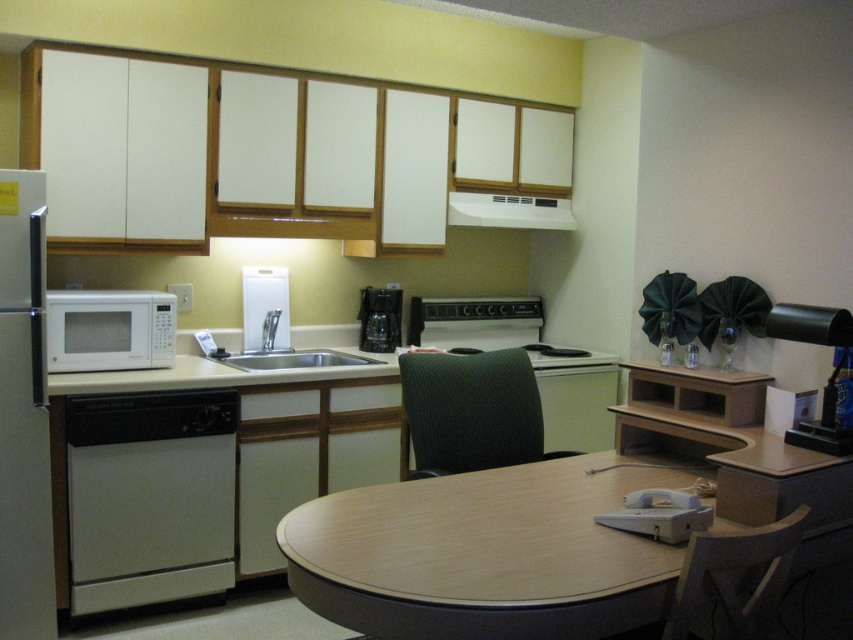
Question: Which of the following is the closest to the observer?

Choices:
 (A) white matte exhaust hood at upper center
 (B) dark gray fabric swivel chair at lower right

Answer: (B)

Question: Which is farther from the dark gray fabric swivel chair at lower right?

Choices:
 (A) white matte exhaust hood at upper center
 (B) white plastic faucet at center
 (C) white matte refrigerator at left

Answer: (B)

Question: Does wooden table at center appear under white matte microwave at left?

Choices:
 (A) no
 (B) yes

Answer: (B)

Question: Considering the real-world distances, which object is farthest from the silver metallic sink at center?

Choices:
 (A) white matte refrigerator at left
 (B) white matte microwave at left

Answer: (A)

Question: Is silver metallic sink at center above black plastic coffee maker at center?

Choices:
 (A) no
 (B) yes

Answer: (A)

Question: Can you confirm if white matte refrigerator at left is positioned to the right of black plastic coffee maker at center?

Choices:
 (A) yes
 (B) no

Answer: (B)